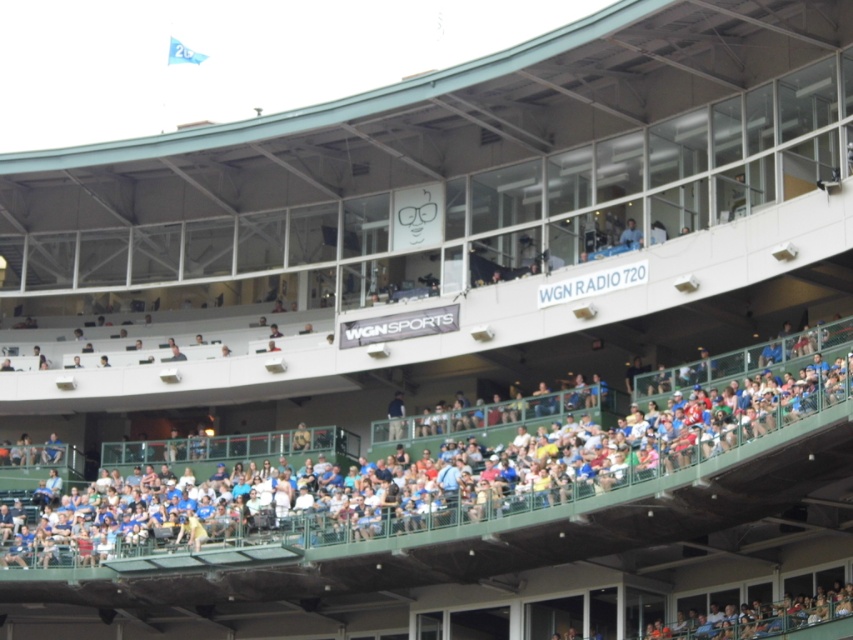
You are sitting in the lower level of the baseball stadium and want to watch the game on the field. There are green plastic seats at center and a blue shirt at upper center in your line of sight. Which object is blocking your view more because of its size?

The green plastic seats at center is blocking your view more because it has a larger size compared to the blue shirt at upper center.

You are standing at the point marked by the coordinates point (498, 516) in the baseball stadium. If you want to walk to the nearest exit, which is located 200 feet away from your current position, will you be able to reach it without moving more than 200 feet?

The distance between your current position at point (498, 516) and the viewer is 238.51 feet. Since the nearest exit is only 200 feet away, you would need to walk 238.51 feet to reach the viewer, which is farther than the 200 feet limit. Therefore, you cannot reach the exit without exceeding the distance limit.

Please look at the baseball stadium scene. There is a point labeled as point (447, 465). Is this point located on the green plastic seats at center?

Yes, the point (447, 465) is located on the green plastic seats at center as stated in the description.